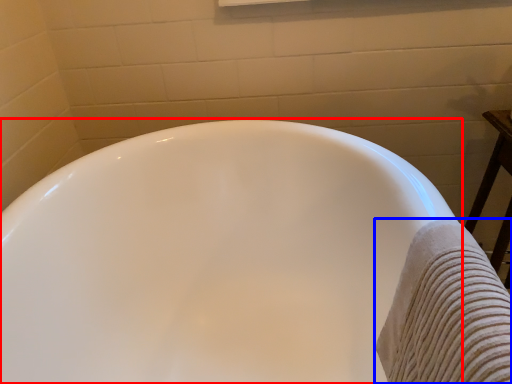
Question: Which point is closer to the camera, bathtub (highlighted by a red box) or bath towel (highlighted by a blue box)?

Choices:
 (A) bathtub
 (B) bath towel

Answer: (B)